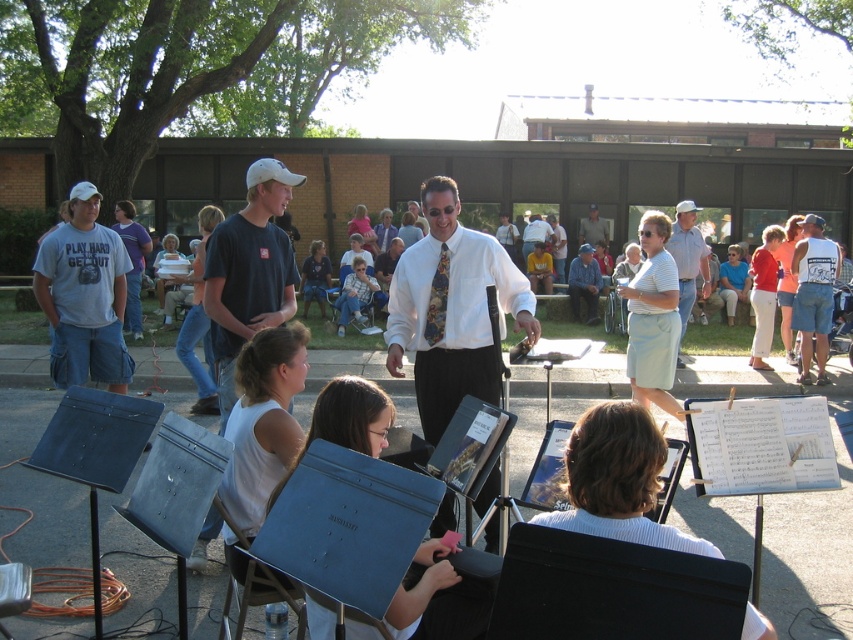
You are a photographer at the event and want to capture both the white silk shirt at center and the light blue shirt at center in the same frame. Which shirt should you position closer to the left side of your camera viewfinder to include both?

To include both the white silk shirt at center and the light blue shirt at center in the same frame, position the white silk shirt at center closer to the left side of your camera viewfinder since it is already to the left of the light blue shirt at center.

You are a photographer trying to capture a photo of the musical performance. You notice two points marked in the scene. The first point is at coordinates point (112,246) and the second is at point (676,218). If you want to ensure both points are visible in your photo, which point should you focus on first to frame the shot properly?

You should focus on point (112,246) first because it is in front of point (676,218), so capturing it first will help frame the shot to include both points.